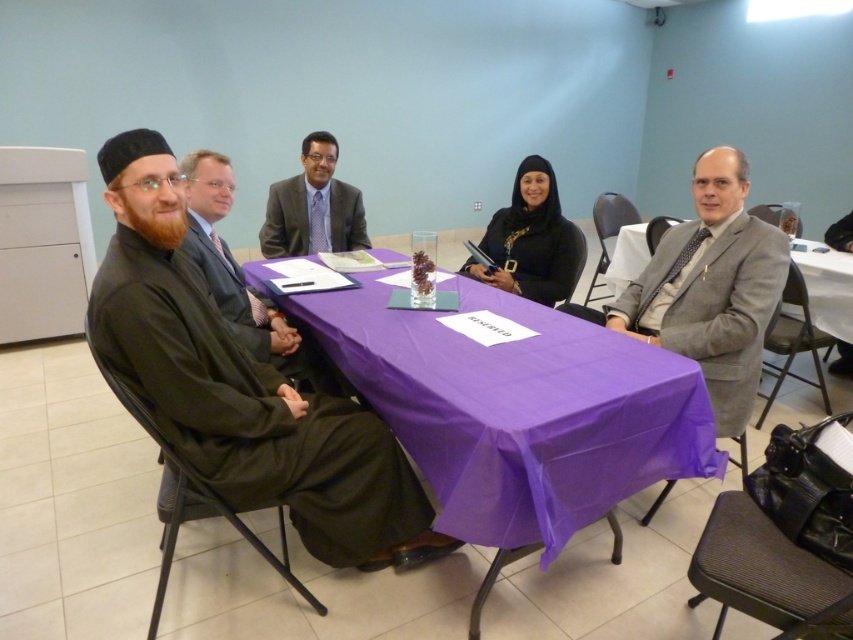
Question: Which object is closer to the camera taking this photo?

Choices:
 (A) matte black robe at center
 (B) black satin robe at center
 (C) matte black robe at left
 (D) purple fabric table at center

Answer: (D)

Question: Among these points, which one is farthest from the camera?

Choices:
 (A) (502, 232)
 (B) (827, 237)
 (C) (154, 362)
 (D) (418, 316)

Answer: (B)

Question: Is purple fabric table at center wider than matte black robe at left?

Choices:
 (A) no
 (B) yes

Answer: (B)

Question: Does purple fabric table at center appear on the right side of black satin robe at center?

Choices:
 (A) yes
 (B) no

Answer: (B)

Question: Among these objects, which one is nearest to the camera?

Choices:
 (A) dark olive-green fabric at left
 (B) matte black robe at center
 (C) black satin robe at center
 (D) gray wool suit at right

Answer: (A)

Question: Can you confirm if gray wool suit at right is smaller than matte black robe at center?

Choices:
 (A) no
 (B) yes

Answer: (A)